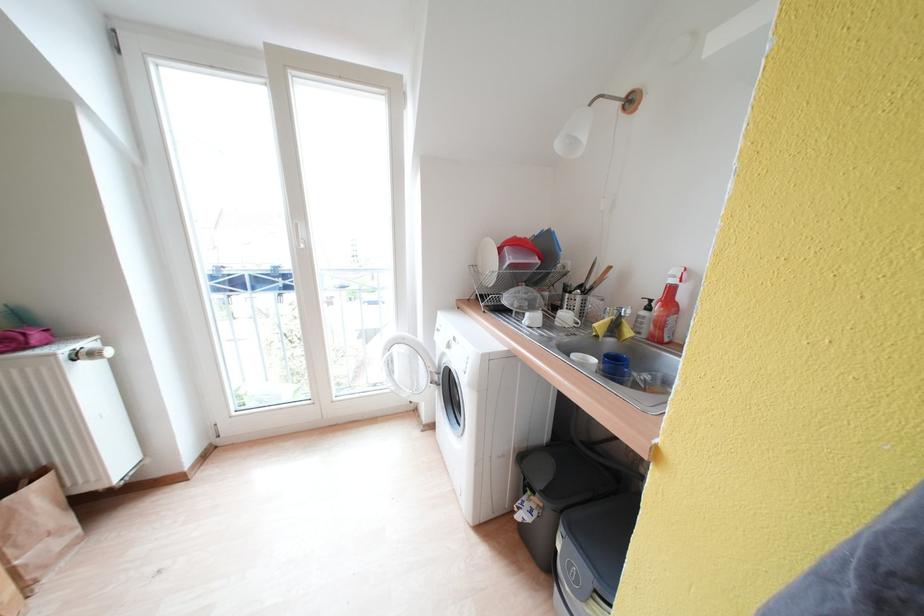
At what (x,y) coordinates should I click in order to perform the action: click on radiator control knob. Please return your answer as a coordinate pair (x, y). The height and width of the screenshot is (616, 924). Looking at the image, I should click on (66, 416).